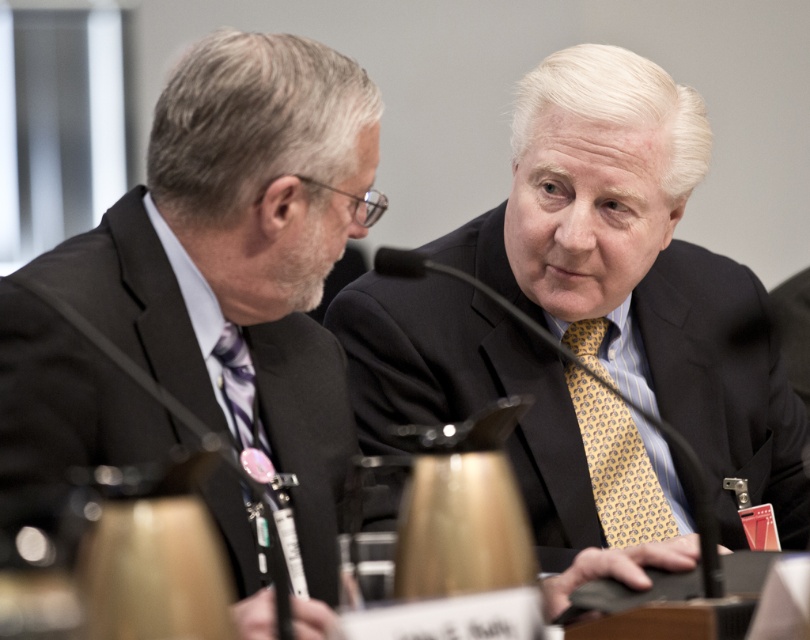
You are attending a virtual meeting and need to focus on the two points in the image. Which point, point (548,156) or point (348,198), is located closer to the front of the scene?

Point (348,198) is closer to the front of the scene because it is in front of point (548,156).

You are attending a virtual meeting and need to determine which of the two points, point (348, 452) or point (623, 420), is closer to you. Based on the scene description, which point is nearer?

Point (348, 452) is closer to the viewer than point (623, 420).

Based on the photo, you are standing at the camera position and want to reach the point at coordinates [667,269]. Can you walk directly to it without moving around any obstacles?

The point at coordinates [667,269] is 1.79 meters away from the camera. Since there are no obstacles mentioned in the scene description, you can walk directly to it without needing to move around any objects.